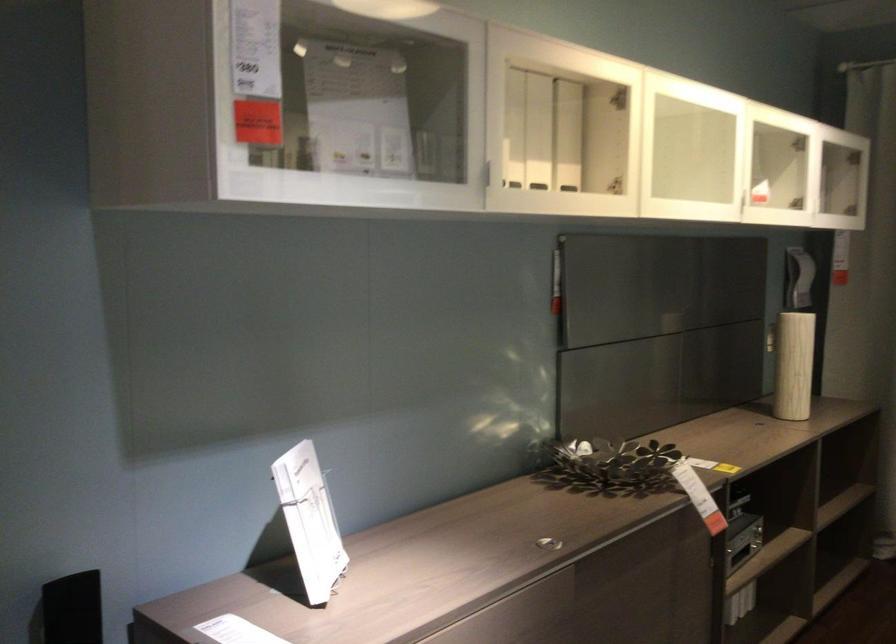
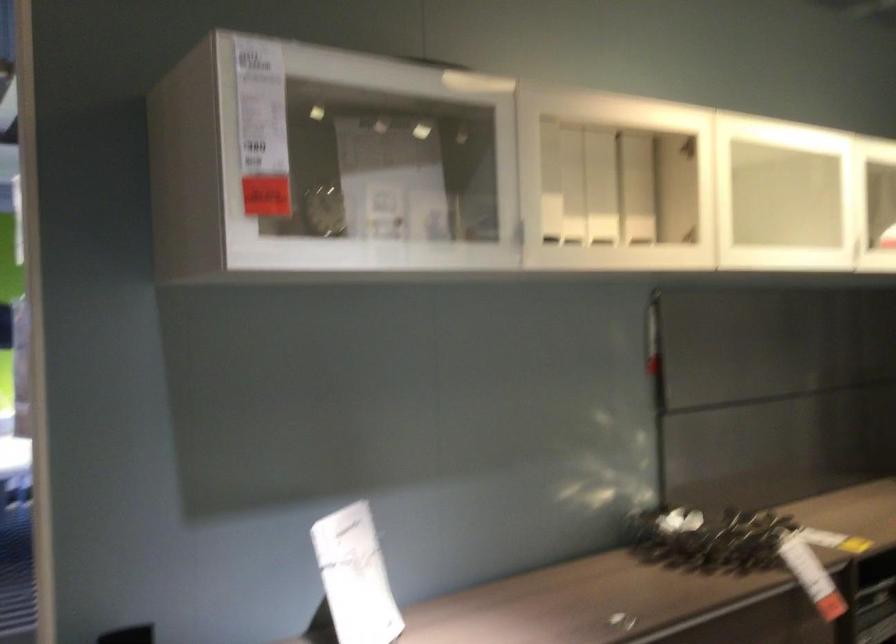
Locate, in the second image, the point that corresponds to [618,100] in the first image.

(688, 147)